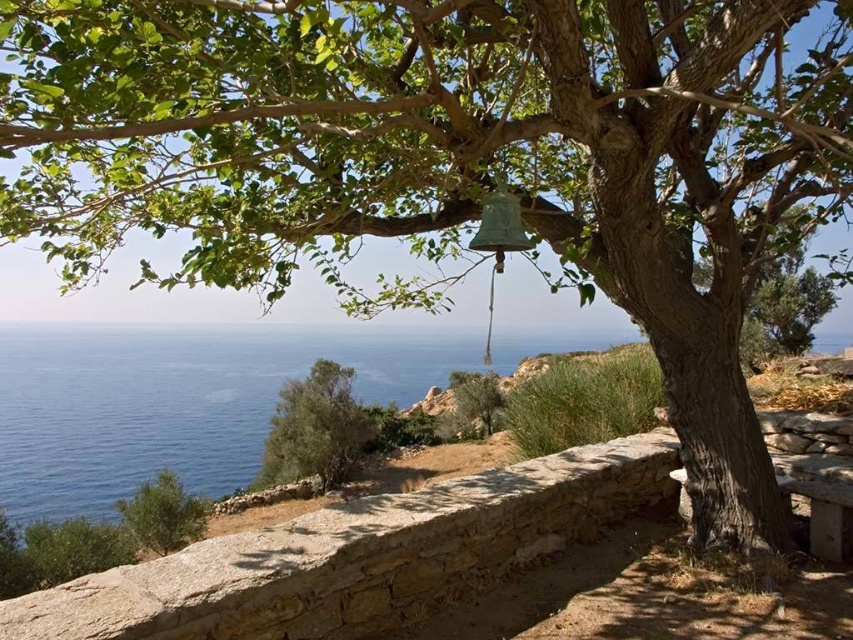
Is stone wall at center shorter than blue water at lower left?

Yes.

Is stone wall at center closer to camera compared to blue water at lower left?

Yes, stone wall at center is closer to the viewer.

Is point (646, 444) positioned behind point (283, 362)?

No, (646, 444) is in front of (283, 362).

Find the location of a particular element. stone wall at center is located at coordinates (357, 556).

Does point (438, 600) come behind point (318, 426)?

No, it is not.

Does stone wall at center have a lesser width compared to green leafy shrub at lower left?

Incorrect, stone wall at center's width is not less than green leafy shrub at lower left's.

Which is behind, point (468, 518) or point (338, 472)?

The point (338, 472) is more distant.

You are a GUI agent. You are given a task and a screenshot of the screen. Output one action in this format:
    pyautogui.click(x=<x>, y=<y>)
    Task: Click on the stone wall at center
    Image resolution: width=853 pixels, height=640 pixels.
    Given the screenshot: What is the action you would take?
    pyautogui.click(x=357, y=556)

Which of these two, blue water at lower left or green leafy tree at center, stands shorter?

With less height is green leafy tree at center.

The image size is (853, 640). What do you see at coordinates (173, 403) in the screenshot? I see `blue water at lower left` at bounding box center [173, 403].

What do you see at coordinates (173, 403) in the screenshot? The width and height of the screenshot is (853, 640). I see `blue water at lower left` at bounding box center [173, 403].

Where is `blue water at lower left`? Image resolution: width=853 pixels, height=640 pixels. blue water at lower left is located at coordinates (173, 403).